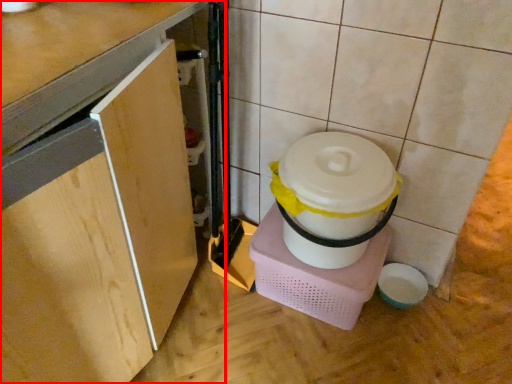
Question: From the image's perspective, considering the relative positions of cabinetry (annotated by the red box) and appliance in the image provided, where is cabinetry (annotated by the red box) located with respect to the staircase?

Choices:
 (A) below
 (B) above

Answer: (B)